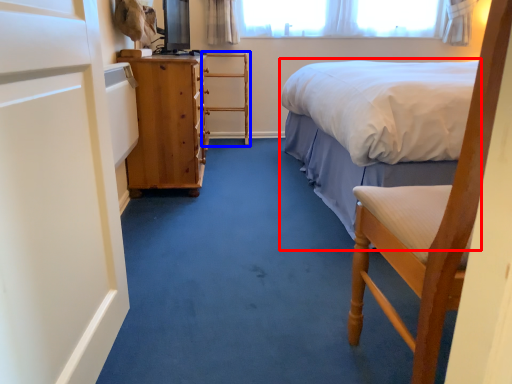
Question: Which object appears closest to the camera in this image, bed (highlighted by a red box) or armchair (highlighted by a blue box)?

Choices:
 (A) bed
 (B) armchair

Answer: (A)